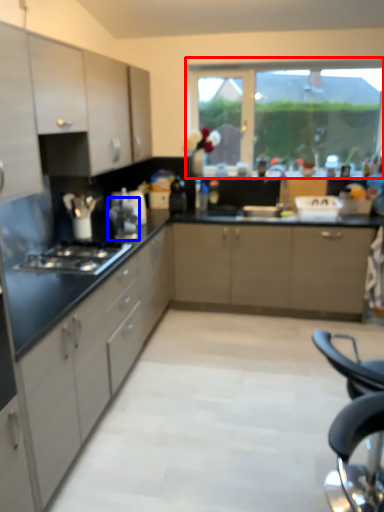
Question: Which object is further to the camera taking this photo, window (highlighted by a red box) or appliance (highlighted by a blue box)?

Choices:
 (A) window
 (B) appliance

Answer: (A)